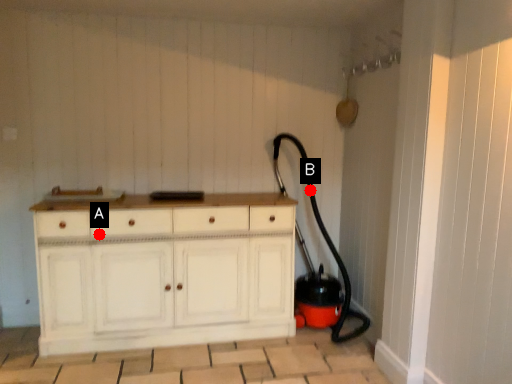
Question: Two points are circled on the image, labeled by A and B beside each circle. Which of the following is the farthest from the observer?

Choices:
 (A) A is further
 (B) B is further

Answer: (B)